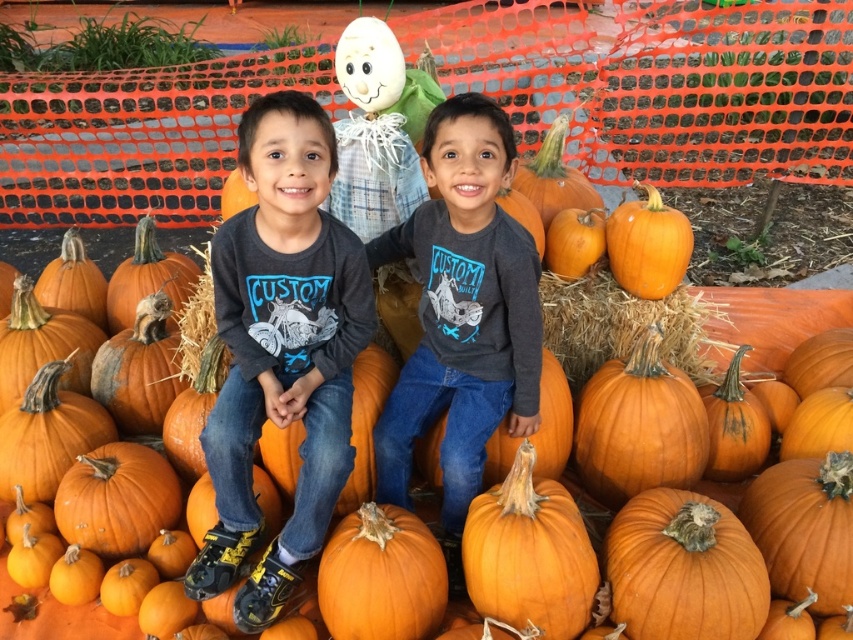
You are a photographer trying to capture a photo of the matte gray shirt at center and the orange matte pumpkin at right. Which object should you focus on first if you want to ensure both are in focus without adjusting your camera settings?

The matte gray shirt at center is taller than the orange matte pumpkin at right, so focusing on the taller object first will ensure both are in focus as the depth of field will cover the smaller object.

You are planning to carve a pumpkin for Halloween. You want to choose the pumpkin that is wider. Which one should you pick between the orange matte pumpkin at center and the orange matte pumpkin at right?

The orange matte pumpkin at center is wider than the orange matte pumpkin at right, so you should pick the orange matte pumpkin at center.